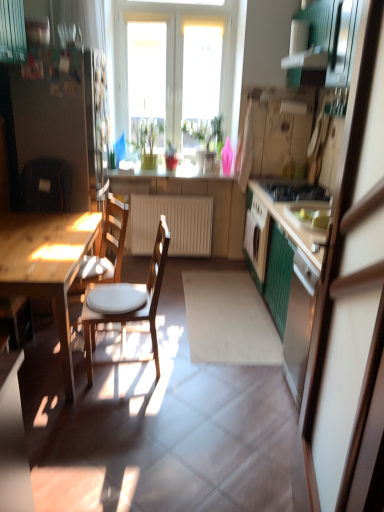
Question: Is green glossy plant at center, which is the first houseplant from left to right, not within green wood cabinet at right?

Choices:
 (A) no
 (B) yes

Answer: (B)

Question: From a real-world perspective, is green glossy plant at center, the second houseplant viewed from the right, on top of green wood cabinet at right?

Choices:
 (A) no
 (B) yes

Answer: (B)

Question: Are green glossy plant at center, the second houseplant viewed from the right, and green wood cabinet at right beside each other?

Choices:
 (A) yes
 (B) no

Answer: (B)

Question: Could you tell me if green glossy plant at center, the second houseplant viewed from the right, is facing green wood cabinet at right?

Choices:
 (A) no
 (B) yes

Answer: (A)

Question: Is green glossy plant at center, the second houseplant viewed from the right, wider than green wood cabinet at right?

Choices:
 (A) no
 (B) yes

Answer: (A)

Question: From a real-world perspective, relative to black glossy gas stove at center right, is green matte cabinet at right vertically above or below?

Choices:
 (A) below
 (B) above

Answer: (B)

Question: Choose the correct answer: Is green matte cabinet at right inside black glossy gas stove at center right or outside it?

Choices:
 (A) inside
 (B) outside

Answer: (B)

Question: Is point (370, 252) positioned closer to the camera than point (311, 199)?

Choices:
 (A) closer
 (B) farther

Answer: (A)

Question: Would you say green matte cabinet at right is to the left or to the right of black glossy gas stove at center right in the picture?

Choices:
 (A) left
 (B) right

Answer: (A)

Question: From the image's perspective, relative to wooden chair with white cushion at left, acting as the first chair starting from the front, is green glossy plant at center, the second houseplant viewed from the right, above or below?

Choices:
 (A) below
 (B) above

Answer: (B)

Question: From a real-world perspective, is green glossy plant at center, the second houseplant viewed from the right, above or below wooden chair with white cushion at left, acting as the first chair starting from the front?

Choices:
 (A) below
 (B) above

Answer: (B)

Question: Considering the positions of green glossy plant at center, which is the first houseplant from left to right, and wooden chair with white cushion at left, placed as the 2th chair when sorted from back to front, in the image, is green glossy plant at center, which is the first houseplant from left to right, taller or shorter than wooden chair with white cushion at left, placed as the 2th chair when sorted from back to front,?

Choices:
 (A) tall
 (B) short

Answer: (B)

Question: Which is correct: green glossy plant at center, the second houseplant viewed from the right, is inside wooden chair with white cushion at left, acting as the first chair starting from the front, or outside of it?

Choices:
 (A) inside
 (B) outside

Answer: (B)

Question: Do you think black glossy gas stove at center right is within green wood cabinet at right, or outside of it?

Choices:
 (A) outside
 (B) inside

Answer: (B)

Question: Considering the positions of black glossy gas stove at center right and green wood cabinet at right in the image, is black glossy gas stove at center right wider or thinner than green wood cabinet at right?

Choices:
 (A) wide
 (B) thin

Answer: (B)